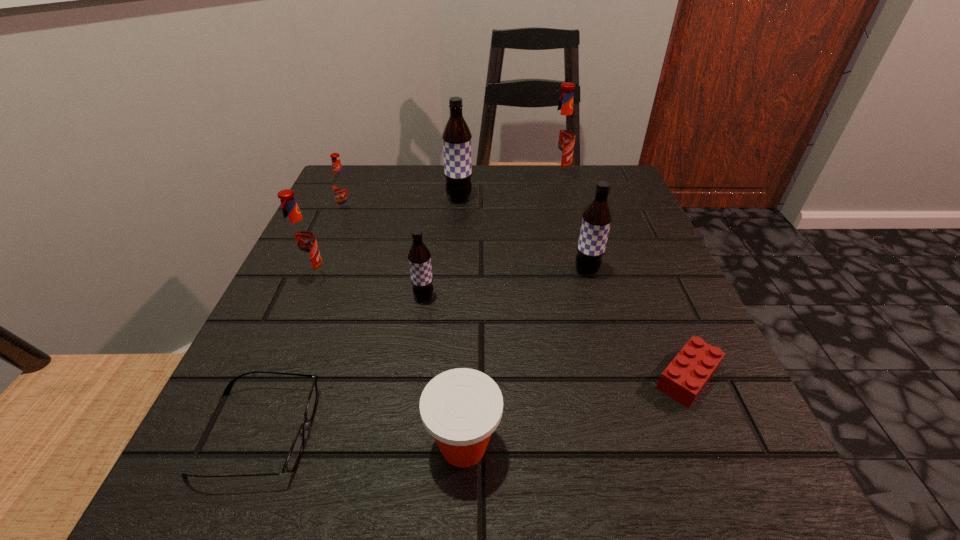
Identify the location of free location located on the front of the third farthest object. This screenshot has width=960, height=540. (339, 232).

Where is `blank space located on the back of the sixth farthest object`? The image size is (960, 540). blank space located on the back of the sixth farthest object is located at coordinates (434, 225).

You are a GUI agent. You are given a task and a screenshot of the screen. Output one action in this format:
    pyautogui.click(x=<x>, y=<y>)
    Task: Click on the vacant space located on the back of the seventh tallest object
    
    Given the screenshot: What is the action you would take?
    pyautogui.click(x=466, y=376)

This screenshot has height=540, width=960. Find the location of `free space located on the back of the Lego`. free space located on the back of the Lego is located at coordinates (621, 222).

Identify the location of blank area located on the front-facing side of the spectacles. The height and width of the screenshot is (540, 960). (497, 433).

Where is `Dixie cup that is at the near edge`? Dixie cup that is at the near edge is located at coordinates (461, 408).

At what (x,y) coordinates should I click in order to perform the action: click on spectacles located in the near edge section of the desktop. Please return your answer as a coordinate pair (x, y). The image size is (960, 540). Looking at the image, I should click on (295, 451).

You are a GUI agent. You are given a task and a screenshot of the screen. Output one action in this format:
    pyautogui.click(x=<x>, y=<y>)
    Task: Click on the spectacles present at the left edge
    This screenshot has width=960, height=540.
    Given the screenshot: What is the action you would take?
    pyautogui.click(x=295, y=451)

Where is `Lego that is positioned at the right edge`? The image size is (960, 540). Lego that is positioned at the right edge is located at coordinates (685, 377).

Image resolution: width=960 pixels, height=540 pixels. I want to click on object present at the far left corner, so pyautogui.click(x=341, y=185).